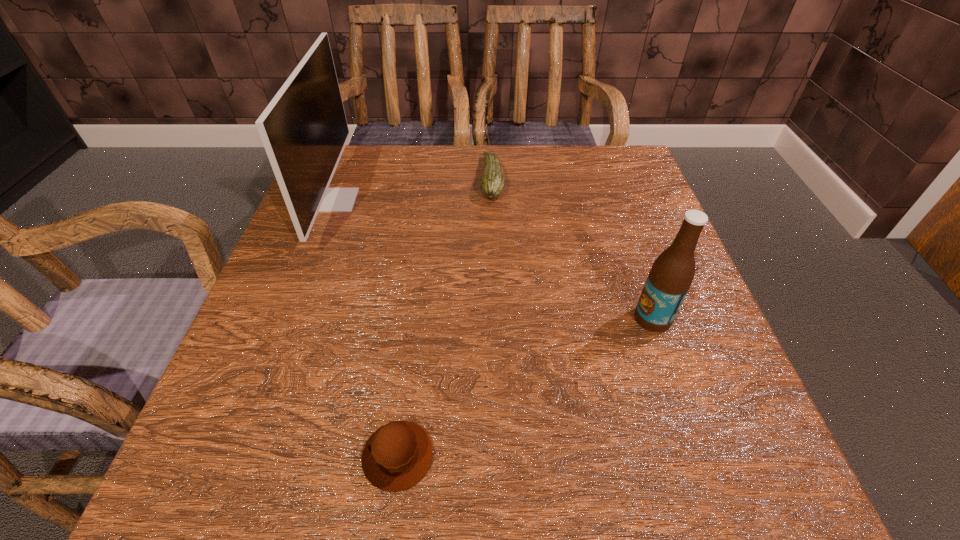
What are the coordinates of `the tallest object` in the screenshot? It's located at (304, 130).

Locate an element on the screen. The height and width of the screenshot is (540, 960). the leftmost object is located at coordinates (304, 130).

Find the location of a particular element. This screenshot has height=540, width=960. the third shortest object is located at coordinates (671, 275).

The image size is (960, 540). Identify the location of the rightmost object. (671, 275).

Locate an element on the screen. The image size is (960, 540). zucchini is located at coordinates (x=492, y=185).

You are a GUI agent. You are given a task and a screenshot of the screen. Output one action in this format:
    pyautogui.click(x=<x>, y=<y>)
    Task: Click on the muffin
    Image resolution: width=960 pixels, height=540 pixels.
    Given the screenshot: What is the action you would take?
    pyautogui.click(x=396, y=456)

This screenshot has height=540, width=960. I want to click on the nearest object, so click(396, 456).

I want to click on free space located on the front-facing side of the tallest object, so click(413, 200).

At what (x,y) coordinates should I click in order to perform the action: click on free space located on the back of the beer bottle. Please return your answer as a coordinate pair (x, y). Image resolution: width=960 pixels, height=540 pixels. Looking at the image, I should click on (615, 211).

Where is `free space located 0.260m at the stem end of the zucchini`? free space located 0.260m at the stem end of the zucchini is located at coordinates (371, 179).